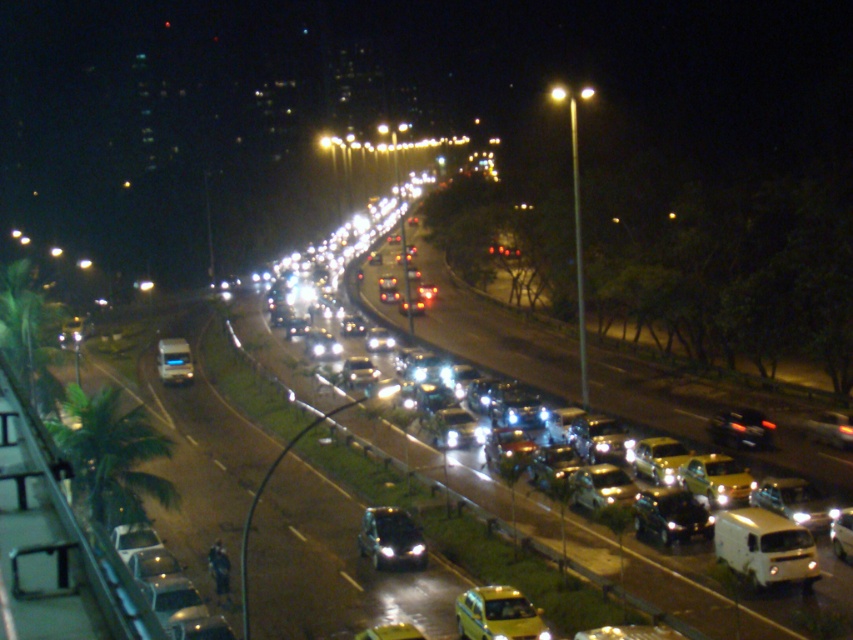
Question: Among these objects, which one is farthest from the camera?

Choices:
 (A) white matte van at lower right
 (B) yellow matte taxi at center
 (C) metallic silver car at center
 (D) shiny black suv at center

Answer: (C)

Question: Which of the following is the closest to the observer?

Choices:
 (A) (376, 522)
 (B) (181, 355)
 (C) (518, 621)

Answer: (C)

Question: Is white matte van at lower right smaller than metallic silver car at center?

Choices:
 (A) no
 (B) yes

Answer: (B)

Question: Among these objects, which one is nearest to the camera?

Choices:
 (A) shiny black suv at center
 (B) yellow matte taxi at center
 (C) white matte van at lower right

Answer: (B)

Question: Does shiny black suv at center have a larger size compared to metallic silver car at center?

Choices:
 (A) yes
 (B) no

Answer: (B)

Question: Is yellow matte taxi at center closer to the viewer compared to shiny black suv at center?

Choices:
 (A) yes
 (B) no

Answer: (A)